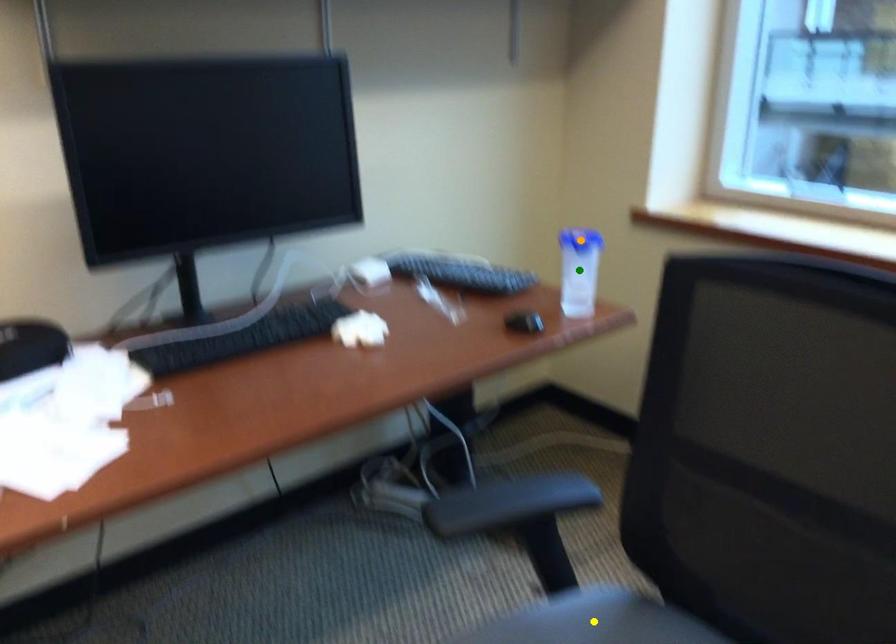
Order these from nearest to farthest:
A) yellow point
B) orange point
C) green point

orange point, green point, yellow point